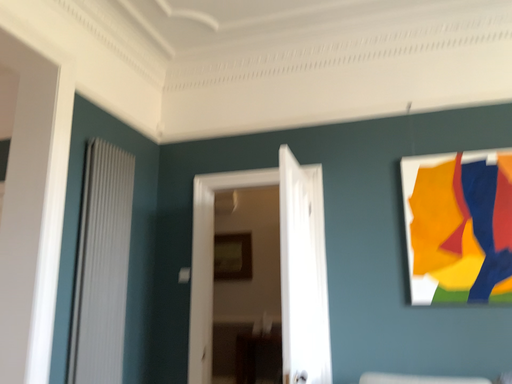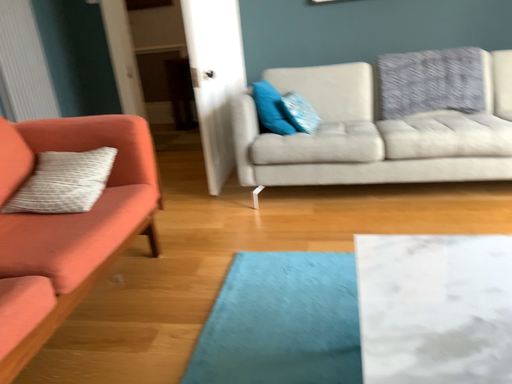
Question: How did the camera likely rotate when shooting the video?

Choices:
 (A) rotated right
 (B) rotated left

Answer: (A)